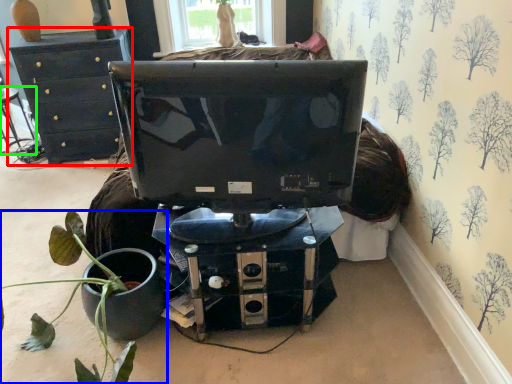
Question: Which object is positioned farthest from furniture (highlighted by a red box)? Select from houseplant (highlighted by a blue box) and chair (highlighted by a green box).

Choices:
 (A) houseplant
 (B) chair

Answer: (A)